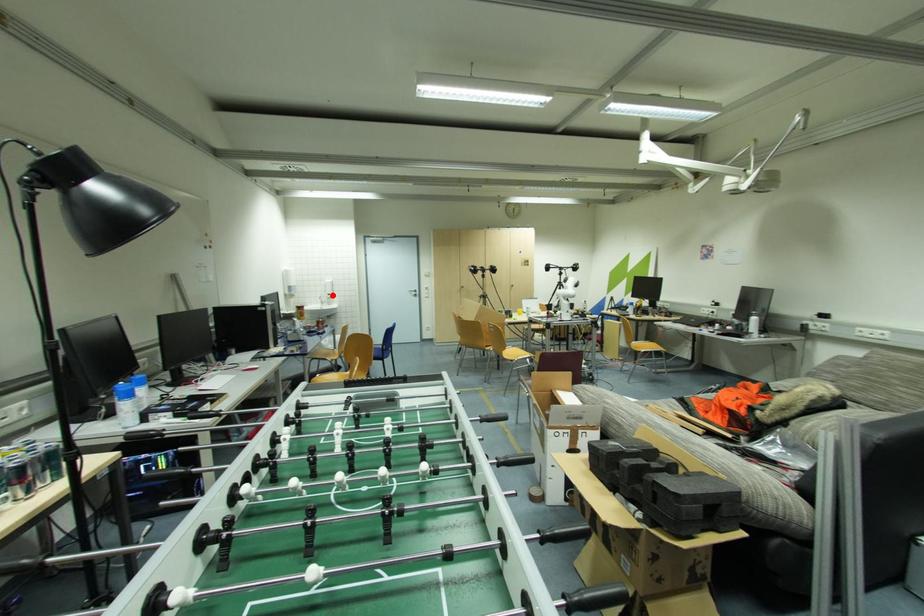
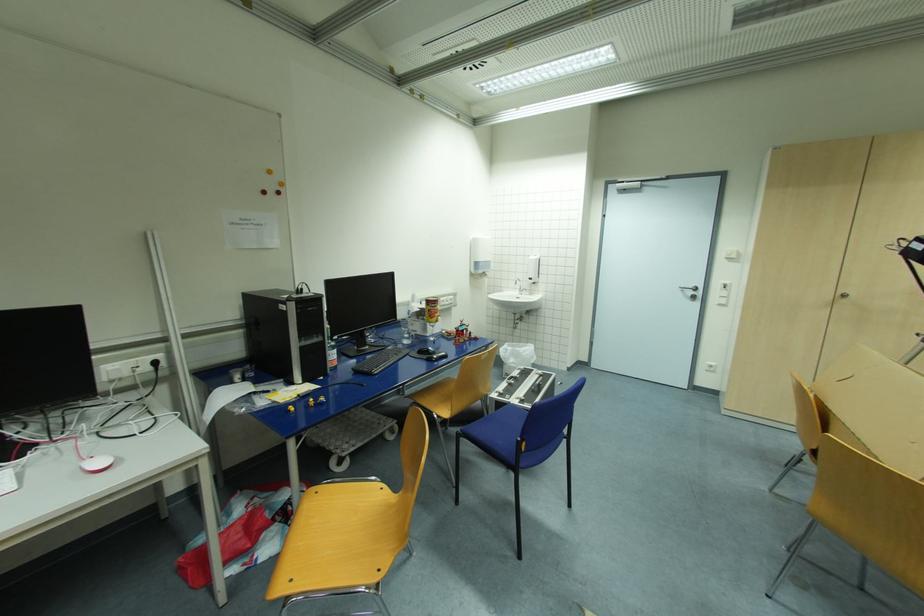
Question: A red point is marked in image1. In image2, is the corresponding 3D point closer to the camera or farther? Reply with the corresponding letter.

Choices:
 (A) The corresponding 3D point is closer.
 (B) The corresponding 3D point is farther.

Answer: (B)